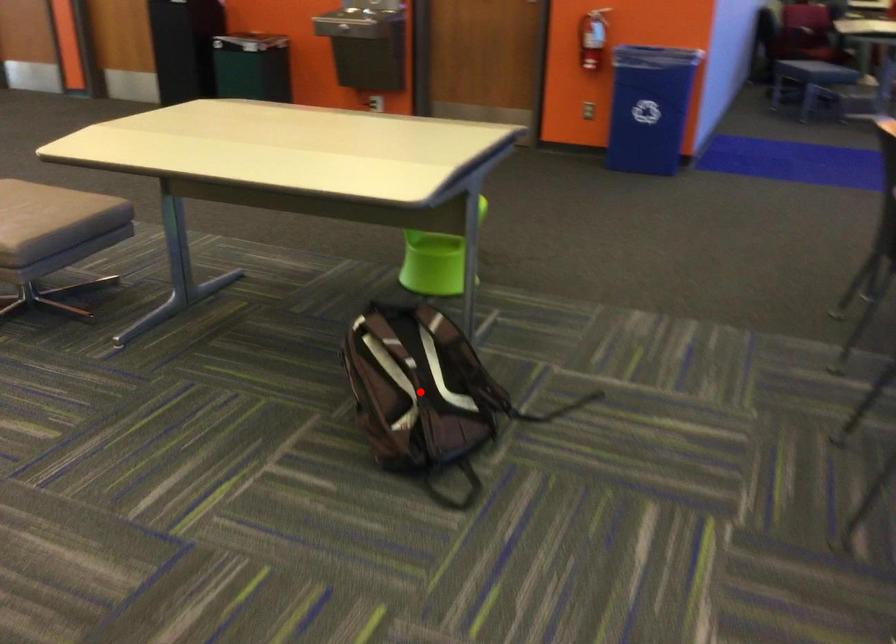
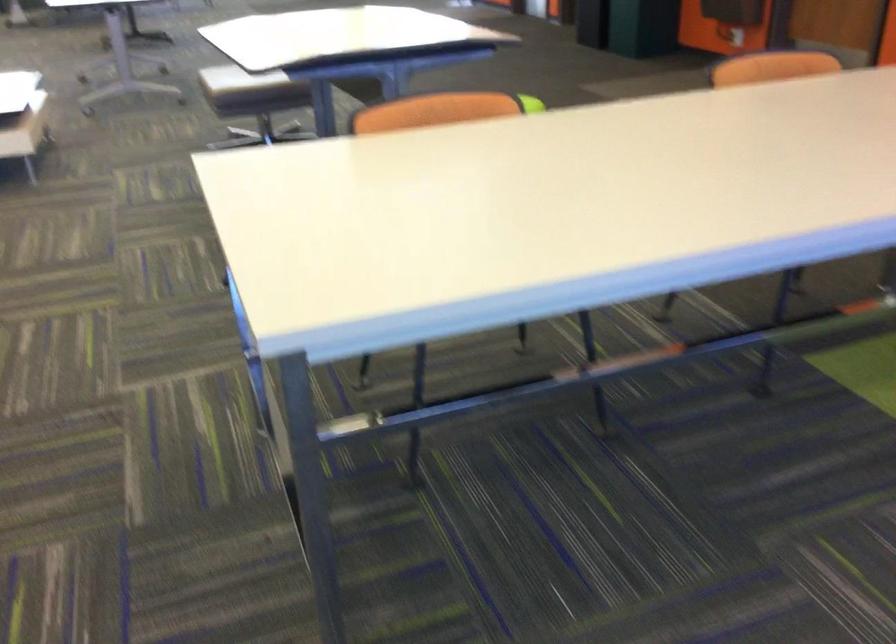
Question: I am providing you with two images of the same scene from different viewpoints. A red point is marked on the first image. At the location where the point appears in image 1, is it still visible in image 2?

Choices:
 (A) Yes
 (B) No

Answer: (B)